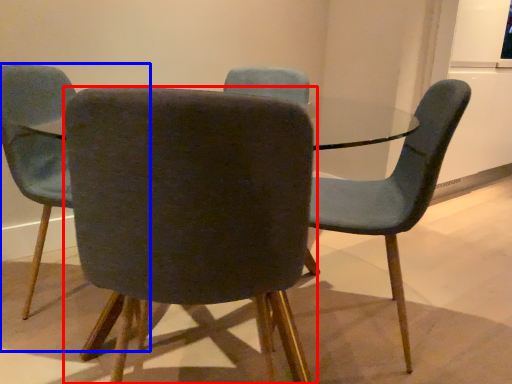
Question: Which object appears closest to the camera in this image, chair (highlighted by a red box) or chair (highlighted by a blue box)?

Choices:
 (A) chair
 (B) chair

Answer: (A)